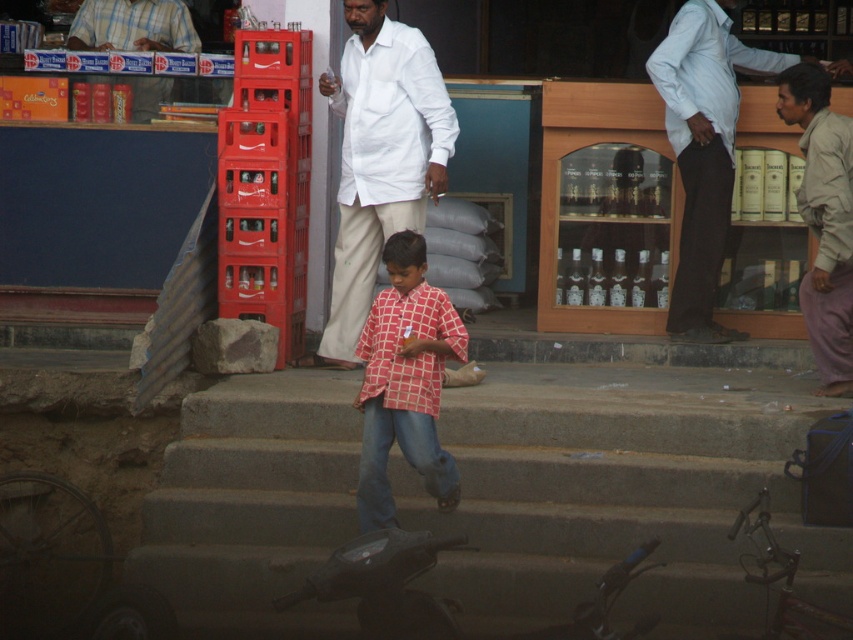
Question: Which point is closer to the camera taking this photo?

Choices:
 (A) (387, 406)
 (B) (712, 339)
 (C) (369, 422)
 (D) (358, 326)

Answer: (A)

Question: Is light beige pants at right closer to the viewer compared to plaid shirt at upper left?

Choices:
 (A) no
 (B) yes

Answer: (B)

Question: Which point is closer to the camera?

Choices:
 (A) checkered fabric shirt at center
 (B) concrete stairs at center
 (C) light blue shirt at upper right

Answer: (B)

Question: Is white cotton shirt at center to the left of checkered fabric shirt at center from the viewer's perspective?

Choices:
 (A) yes
 (B) no

Answer: (A)

Question: Is white cotton shirt at center thinner than light blue shirt at upper right?

Choices:
 (A) no
 (B) yes

Answer: (B)

Question: Among these points, which one is farthest from the camera?

Choices:
 (A) (189, 513)
 (B) (389, 51)
 (C) (781, 88)

Answer: (B)